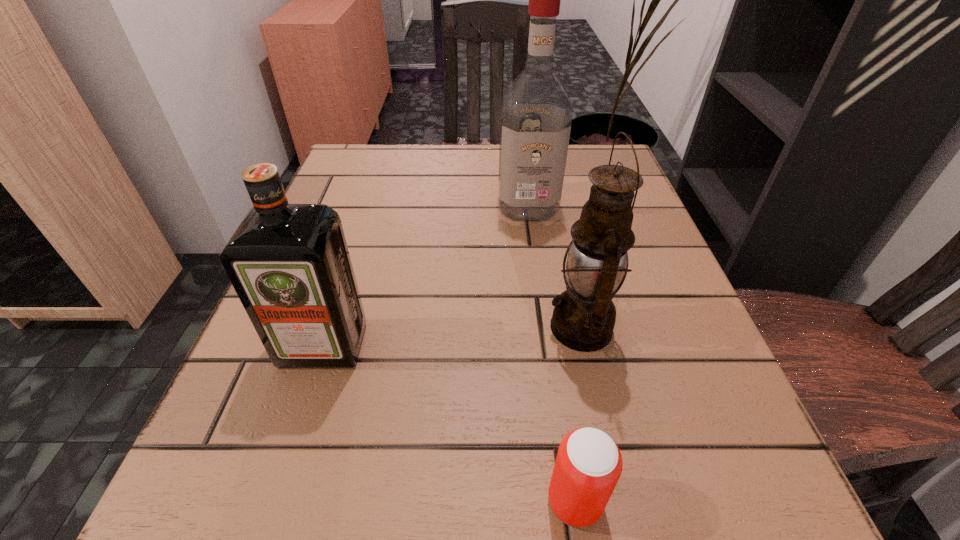
Find the location of a particular element. The image size is (960, 540). the closest object to the shortest object is located at coordinates (583, 319).

Identify which object is the second closest to the oil lamp. Please provide its 2D coordinates. Your answer should be formatted as a tuple, i.e. [(x, y)], where the tuple contains the x and y coordinates of a point satisfying the conditions above.

[(536, 115)]

The image size is (960, 540). I want to click on free spot that satisfies the following two spatial constraints: 1. on the front label of the nearest object; 2. on the left side of the nearer liquor, so click(x=272, y=501).

Locate an element on the screen. Image resolution: width=960 pixels, height=540 pixels. vacant space that satisfies the following two spatial constraints: 1. on the front-facing side of the farther liquor; 2. on the left side of the beer can is located at coordinates (568, 501).

Where is `free region that satisfies the following two spatial constraints: 1. on the front label of the shorter liquor; 2. on the right side of the shortest object`? This screenshot has width=960, height=540. free region that satisfies the following two spatial constraints: 1. on the front label of the shorter liquor; 2. on the right side of the shortest object is located at coordinates (272, 501).

I want to click on free space in the image that satisfies the following two spatial constraints: 1. on the front-facing side of the farther liquor; 2. on the right side of the nearest object, so click(x=568, y=501).

Identify the location of free location that satisfies the following two spatial constraints: 1. on the front-facing side of the tallest object; 2. on the left side of the oil lamp. (544, 327).

What are the coordinates of `free space in the image that satisfies the following two spatial constraints: 1. on the front-facing side of the farther liquor; 2. on the right side of the beer can` in the screenshot? It's located at (568, 501).

The height and width of the screenshot is (540, 960). I want to click on free space that satisfies the following two spatial constraints: 1. on the back side of the beer can; 2. on the left side of the oil lamp, so click(549, 327).

Find the location of a particular element. free location that satisfies the following two spatial constraints: 1. on the front-facing side of the nearest object; 2. on the left side of the farthest object is located at coordinates (568, 501).